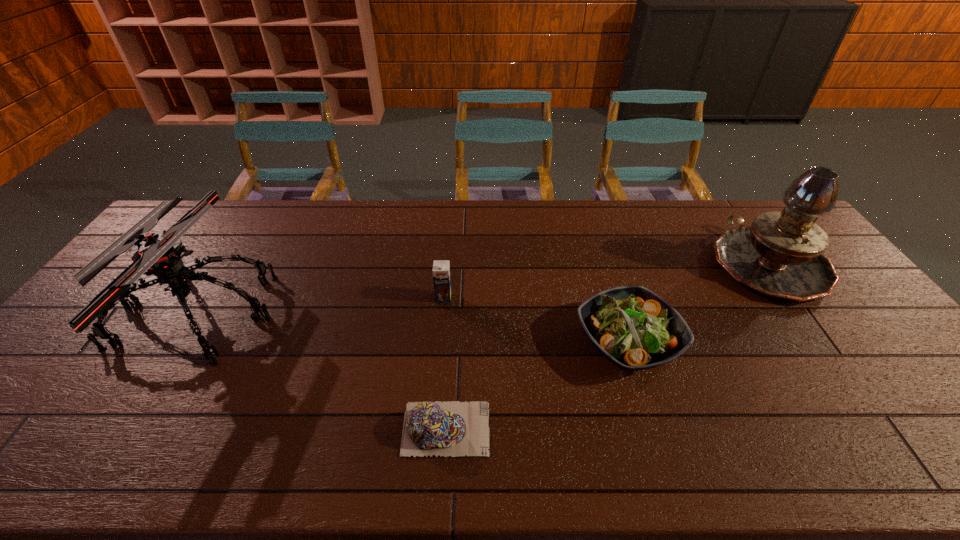
Image resolution: width=960 pixels, height=540 pixels. What are the coordinates of `the rightmost object` in the screenshot? It's located at (780, 255).

You are a GUI agent. You are given a task and a screenshot of the screen. Output one action in this format:
    pyautogui.click(x=<x>, y=<y>)
    Task: Click on the oil lamp
    Image resolution: width=960 pixels, height=540 pixels.
    Given the screenshot: What is the action you would take?
    pyautogui.click(x=780, y=255)

Where is `drone`? The image size is (960, 540). drone is located at coordinates (159, 255).

Identify the location of the leftmost object. This screenshot has width=960, height=540. (159, 255).

Find the location of a particular element. the third shortest object is located at coordinates (441, 268).

The width and height of the screenshot is (960, 540). Identify the location of the second object from right to left. (635, 329).

At what (x,y) coordinates should I click in order to perform the action: click on salad plate. Please return your answer as a coordinate pair (x, y). Looking at the image, I should click on (635, 329).

Where is `cap`? The image size is (960, 540). cap is located at coordinates (453, 428).

At what (x,y) coordinates should I click in order to perform the action: click on the nearest object. Please return your answer as a coordinate pair (x, y). The height and width of the screenshot is (540, 960). Looking at the image, I should click on (453, 428).

Identify the location of free location located 0.110m on the back of the oil lamp. (729, 210).